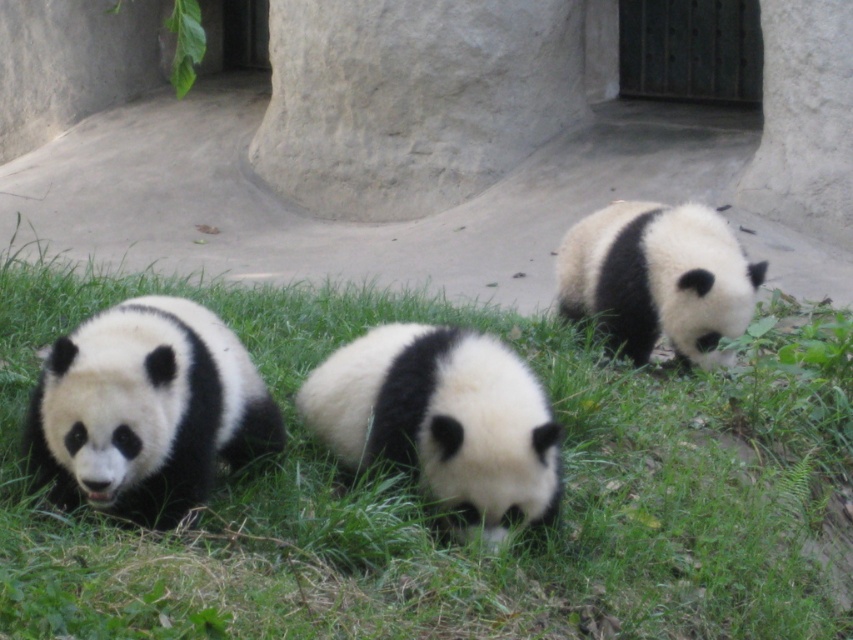
Question: Which of the following is the farthest from the observer?

Choices:
 (A) black and white fur panda at left
 (B) green grass at center

Answer: (A)

Question: Based on their relative distances, which object is farther from the white fur panda at center?

Choices:
 (A) white soft fur panda at center
 (B) black and white fur panda at left

Answer: (B)

Question: Does white soft fur panda at center have a larger size compared to white fur panda at center?

Choices:
 (A) no
 (B) yes

Answer: (A)

Question: Which point appears closest to the camera in this image?

Choices:
 (A) tap(437, 499)
 (B) tap(624, 552)
 (C) tap(660, 289)

Answer: (A)

Question: Is black and white fur panda at left further to the viewer compared to white soft fur panda at center?

Choices:
 (A) yes
 (B) no

Answer: (B)

Question: Does green grass at center appear on the left side of black and white fur panda at left?

Choices:
 (A) yes
 (B) no

Answer: (B)